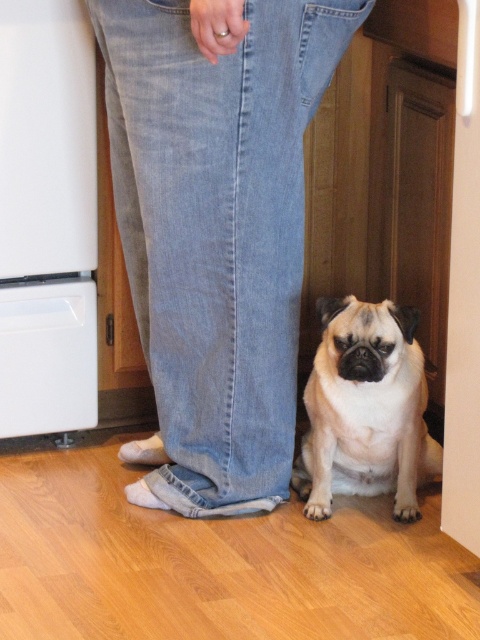
Who is higher up, light blue denim jeans at lower center or white fur dog at lower center?

light blue denim jeans at lower center is higher up.

Find the location of a particular element. This screenshot has width=480, height=640. light blue denim jeans at lower center is located at coordinates (216, 227).

Where is `light blue denim jeans at lower center`? light blue denim jeans at lower center is located at coordinates (216, 227).